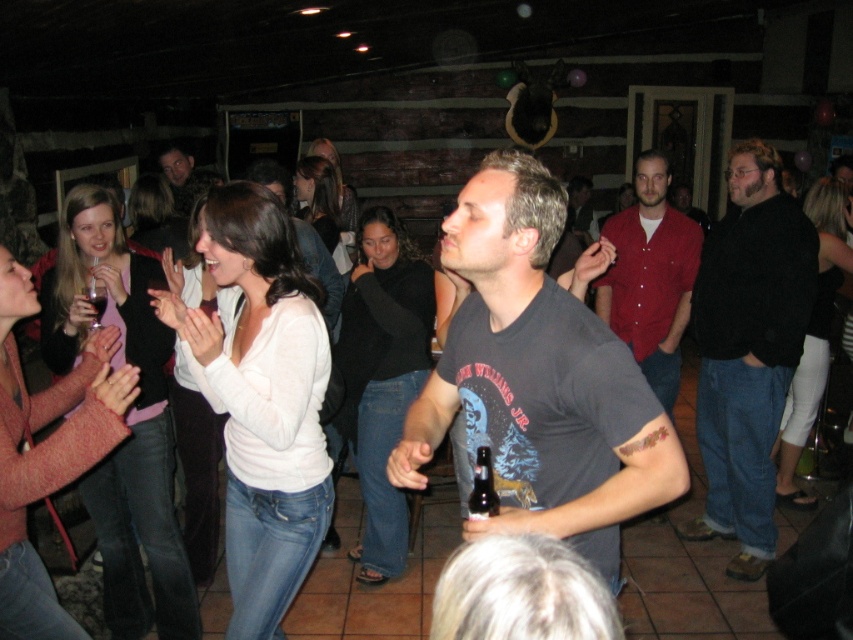
Question: Which point is closer to the camera taking this photo?

Choices:
 (A) (801, 362)
 (B) (318, 180)
 (C) (471, 497)
 (D) (743, 410)

Answer: (C)

Question: Which point is farther from the camera taking this photo?

Choices:
 (A) (149, 204)
 (B) (761, 205)
 (C) (166, 420)

Answer: (A)

Question: Which of the following is the closest to the observer?

Choices:
 (A) (55, 348)
 (B) (831, 316)
 (C) (44, 625)
 (D) (134, 234)

Answer: (C)

Question: Does white matte sweater at center lie behind black matte sweater at center?

Choices:
 (A) no
 (B) yes

Answer: (A)

Question: Considering the relative positions of white leggings at right and dark brown glass bottle at center in the image provided, where is white leggings at right located with respect to dark brown glass bottle at center?

Choices:
 (A) above
 (B) below

Answer: (A)

Question: Is white matte sweater at center further to the viewer compared to white leggings at right?

Choices:
 (A) no
 (B) yes

Answer: (A)